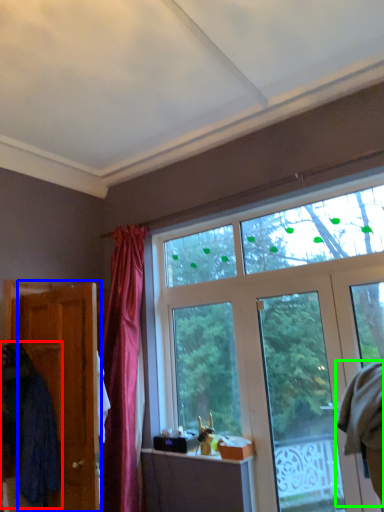
Question: Which object is positioned closest to robe (highlighted by a red box)? Select from door (highlighted by a blue box) and robe (highlighted by a green box).

Choices:
 (A) door
 (B) robe

Answer: (A)